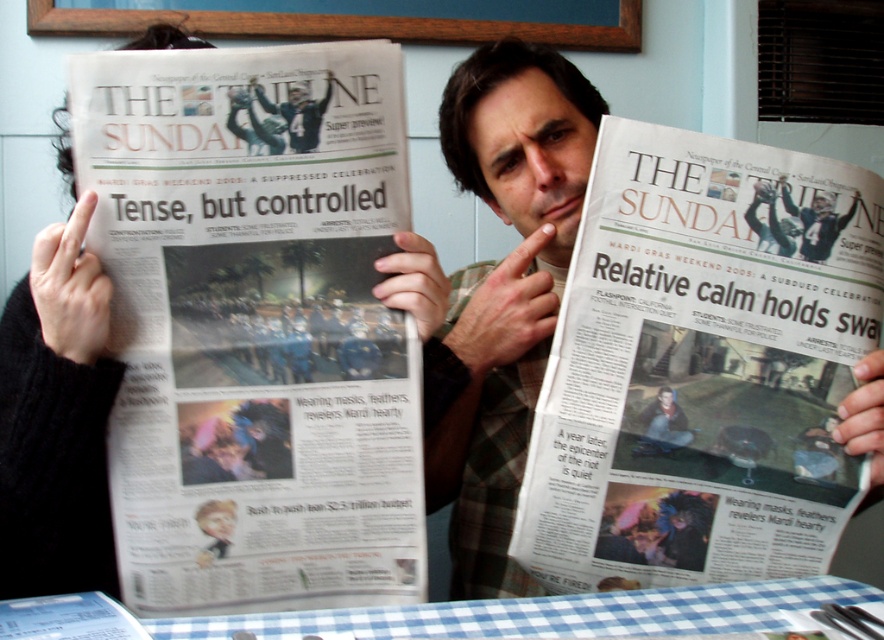
You are a delivery person who needs to place a small package on the table without covering any of the blue checkered tablecloth at lower center. Can you place the package on the white paper newspaper at center?

The white paper newspaper at center has a greater height compared to blue checkered tablecloth at lower center, so placing the package on the white paper newspaper at center would not cover the blue checkered tablecloth at lower center since it is elevated.

You are a delivery person who needs to place a small package between the white paper newspaper at left and the white paper newspaper at center. Can you fit it there?

The white paper newspaper at left is above the white paper newspaper at center, so there is space between them. You can fit the small package between the white paper newspaper at left and the white paper newspaper at center.